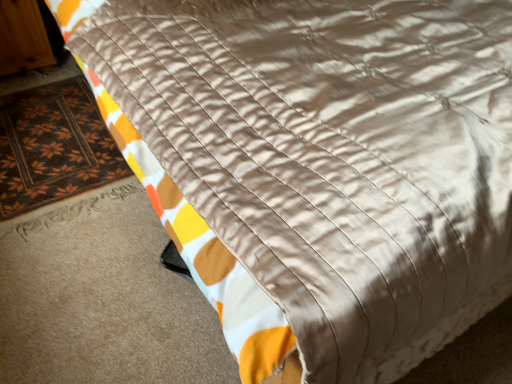
Question: Could wooden armoire at upper left be considered to be inside brown woven mat at lower left?

Choices:
 (A) yes
 (B) no

Answer: (B)

Question: Is brown woven mat at lower left further to camera compared to wooden armoire at upper left?

Choices:
 (A) yes
 (B) no

Answer: (B)

Question: Can you see brown woven mat at lower left touching wooden armoire at upper left?

Choices:
 (A) yes
 (B) no

Answer: (B)

Question: Considering the relative sizes of brown woven mat at lower left and wooden armoire at upper left in the image provided, is brown woven mat at lower left taller than wooden armoire at upper left?

Choices:
 (A) no
 (B) yes

Answer: (A)

Question: From a real-world perspective, is brown woven mat at lower left physically above wooden armoire at upper left?

Choices:
 (A) no
 (B) yes

Answer: (A)

Question: Can you confirm if brown woven mat at lower left is shorter than wooden armoire at upper left?

Choices:
 (A) no
 (B) yes

Answer: (B)

Question: Is wooden armoire at upper left outside of brown woven mat at lower left?

Choices:
 (A) yes
 (B) no

Answer: (A)

Question: Is wooden armoire at upper left to the left of brown woven mat at lower left from the viewer's perspective?

Choices:
 (A) yes
 (B) no

Answer: (A)

Question: Is wooden armoire at upper left thinner than brown woven mat at lower left?

Choices:
 (A) no
 (B) yes

Answer: (B)

Question: Is wooden armoire at upper left shorter than brown woven mat at lower left?

Choices:
 (A) yes
 (B) no

Answer: (B)

Question: Does wooden armoire at upper left appear on the right side of brown woven mat at lower left?

Choices:
 (A) yes
 (B) no

Answer: (B)

Question: Does wooden armoire at upper left have a greater height compared to brown woven mat at lower left?

Choices:
 (A) no
 (B) yes

Answer: (B)

Question: Does point (31, 19) appear closer or farther from the camera than point (46, 150)?

Choices:
 (A) farther
 (B) closer

Answer: (A)